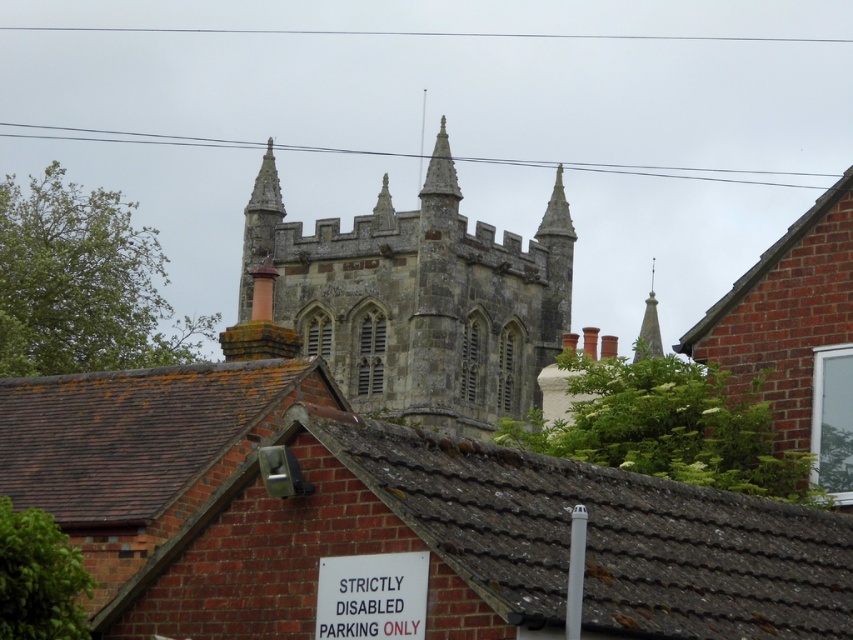
Does point (532, 269) come in front of point (357, 580)?

That is False.

What do you see at coordinates (418, 298) in the screenshot? Image resolution: width=853 pixels, height=640 pixels. I see `stone gothic tower at center` at bounding box center [418, 298].

Is point (519, 392) more distant than point (331, 572)?

Yes, point (519, 392) is behind point (331, 572).

Locate an element on the screen. Image resolution: width=853 pixels, height=640 pixels. stone gothic tower at center is located at coordinates (418, 298).